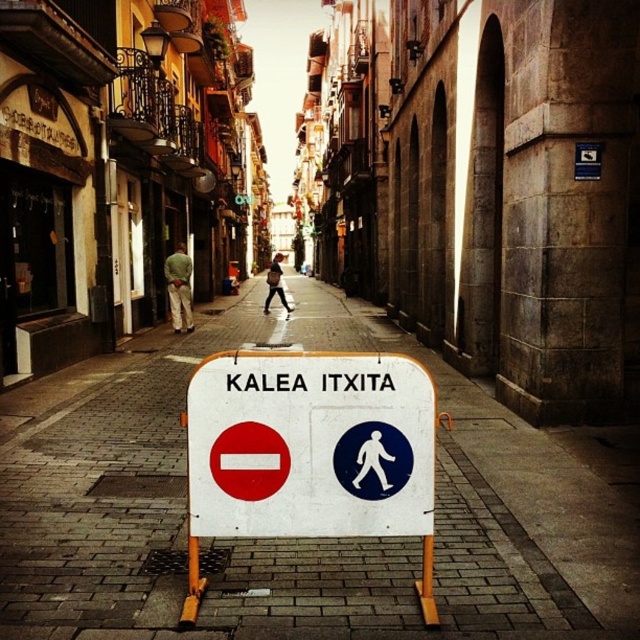
Question: Which point is closer to the camera?

Choices:
 (A) (371, 509)
 (B) (292, 620)

Answer: (B)

Question: Considering the relative positions of white brick pavement at center and white plastic sign at center in the image provided, where is white brick pavement at center located with respect to white plastic sign at center?

Choices:
 (A) below
 (B) above

Answer: (B)

Question: Does white brick pavement at center come behind white plastic sign at center?

Choices:
 (A) yes
 (B) no

Answer: (B)

Question: Which of the following is the closest to the observer?

Choices:
 (A) white brick pavement at center
 (B) white plastic sign at center

Answer: (A)

Question: Is white brick pavement at center positioned before white plastic sign at center?

Choices:
 (A) yes
 (B) no

Answer: (A)

Question: Which point appears farthest from the camera in this image?

Choices:
 (A) (481, 396)
 (B) (340, 461)

Answer: (A)